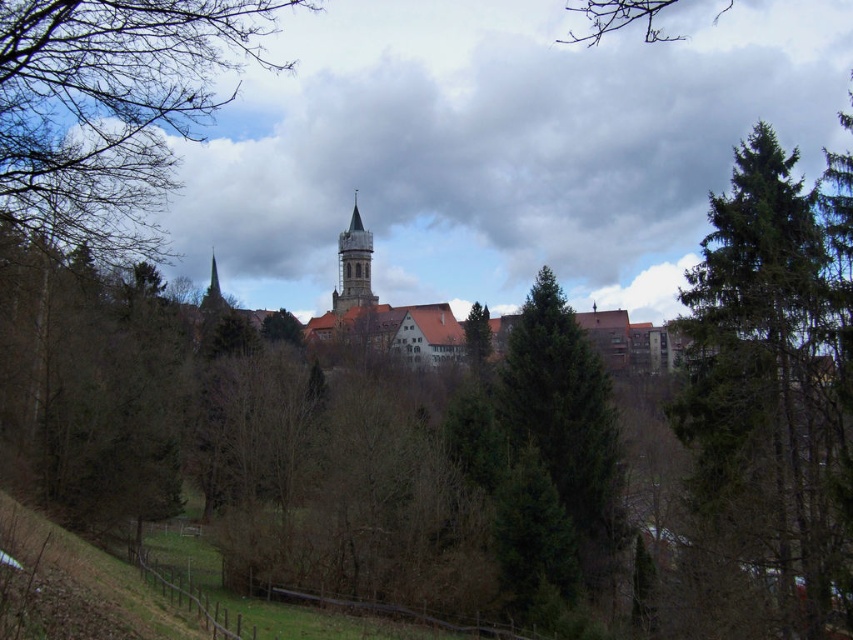
Can you confirm if brown leafless branches at upper left is shorter than green matte tree at center?

Incorrect, brown leafless branches at upper left's height does not fall short of green matte tree at center's.

This screenshot has width=853, height=640. Describe the element at coordinates (112, 108) in the screenshot. I see `brown leafless branches at upper left` at that location.

Does point (125, 145) come behind point (473, 355)?

No, it is in front of (473, 355).

Where is `brown leafless branches at upper left`? The width and height of the screenshot is (853, 640). brown leafless branches at upper left is located at coordinates (112, 108).

Between brown leafless branches at upper left and bare branches at upper center, which one appears on the left side from the viewer's perspective?

From the viewer's perspective, brown leafless branches at upper left appears more on the left side.

Which of these two, brown leafless branches at upper left or bare branches at upper center, stands taller?

→ brown leafless branches at upper left is taller.

Locate an element on the screen. brown leafless branches at upper left is located at coordinates [x=112, y=108].

Which is above, brown leafless branches at upper left or smooth gray stone tower at center?

brown leafless branches at upper left is above.

Which of these two, brown leafless branches at upper left or smooth gray stone tower at center, stands taller?

brown leafless branches at upper left

Locate an element on the screen. This screenshot has width=853, height=640. brown leafless branches at upper left is located at coordinates (112, 108).